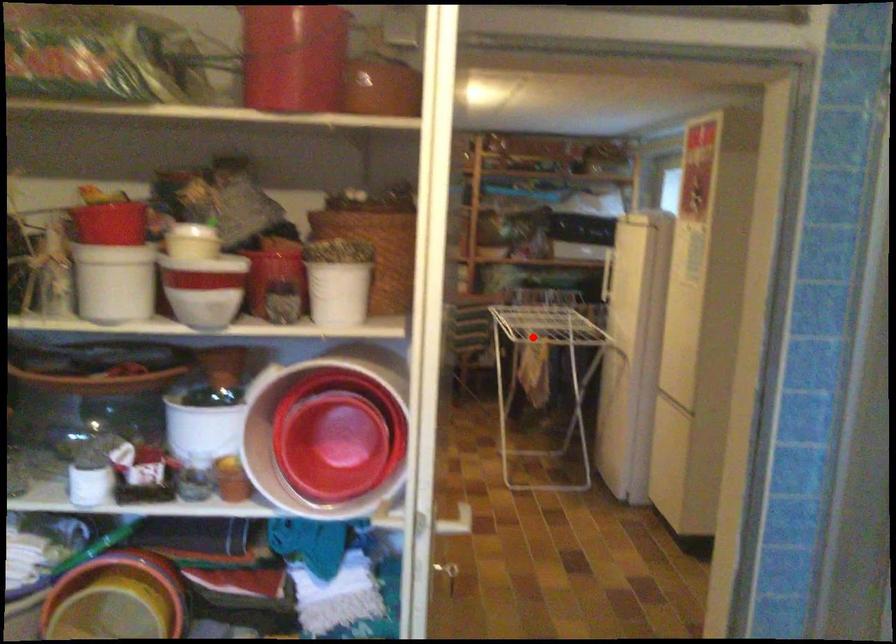
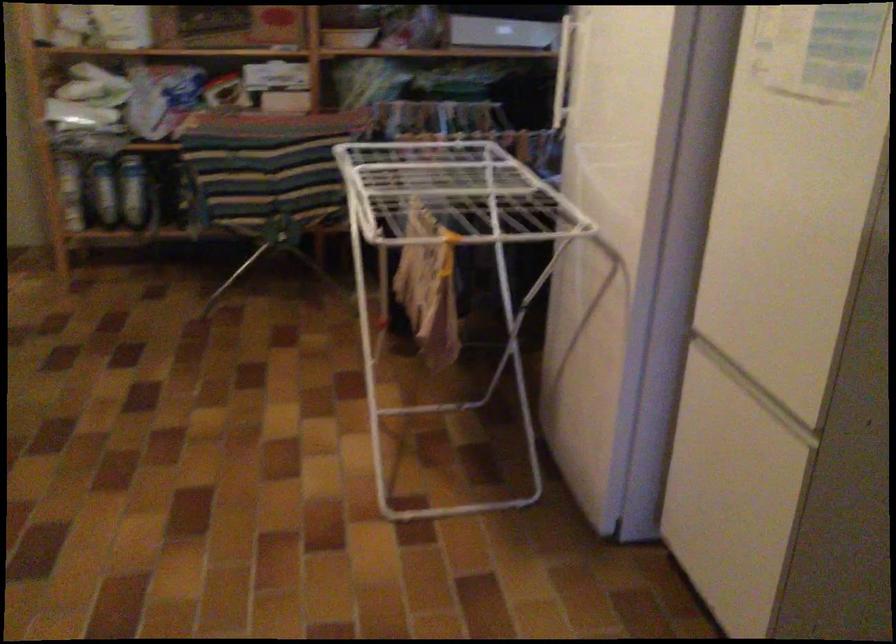
Question: I am providing you with two images of the same scene from different viewpoints. In image1, a red point is highlighted. Considering the same 3D point in image2, which of the following is correct?

Choices:
 (A) It is closer
 (B) It is farther

Answer: (A)